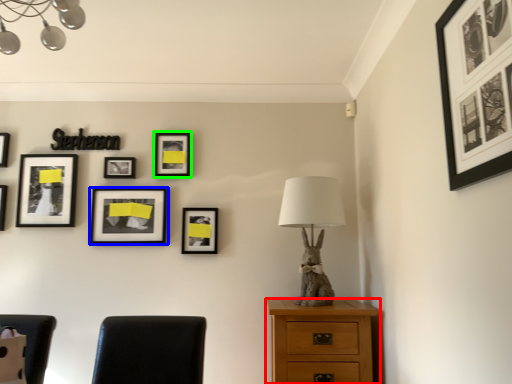
Question: Which object is positioned closest to chest of drawers (highlighted by a red box)? Select from picture frame (highlighted by a blue box) and picture frame (highlighted by a green box).

Choices:
 (A) picture frame
 (B) picture frame

Answer: (A)